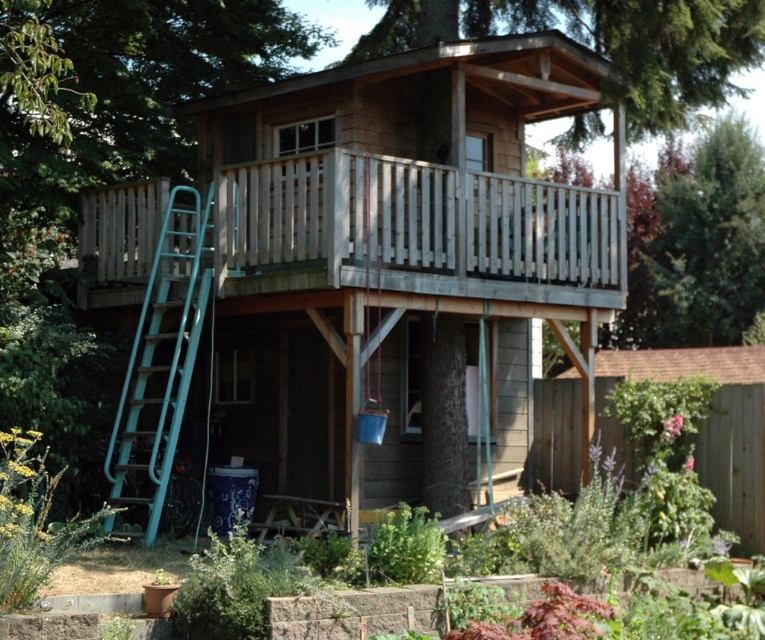
Question: Is wooden deck at upper center below teal metallic ladder at left?

Choices:
 (A) yes
 (B) no

Answer: (A)

Question: Among these objects, which one is nearest to the camera?

Choices:
 (A) teal metallic ladder at left
 (B) wooden deck at upper center
 (C) weathered wood porch at upper center
 (D) brown wooden porch at upper center

Answer: (A)

Question: Which object appears farthest from the camera in this image?

Choices:
 (A) teal metallic ladder at left
 (B) wooden deck at upper center

Answer: (B)

Question: Is weathered wood porch at upper center wider than green leafy tree at upper right?

Choices:
 (A) no
 (B) yes

Answer: (A)

Question: Is wooden deck at upper center above weathered wood porch at upper center?

Choices:
 (A) yes
 (B) no

Answer: (B)

Question: Which of the following is the closest to the observer?

Choices:
 (A) (114, 492)
 (B) (282, 192)

Answer: (A)